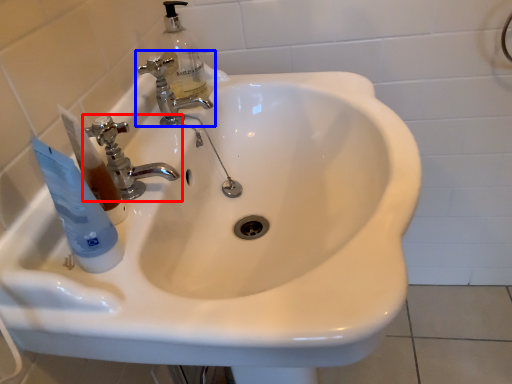
Question: Which point is closer to the camera, tap (highlighted by a red box) or tap (highlighted by a blue box)?

Choices:
 (A) tap
 (B) tap

Answer: (A)